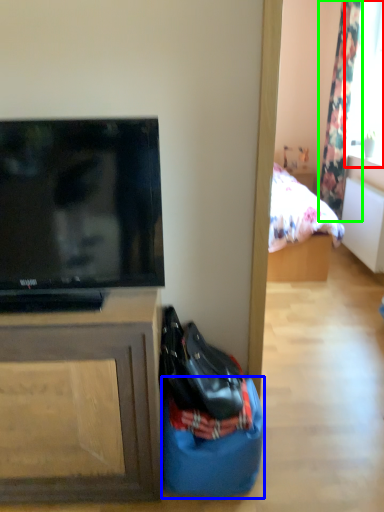
Question: Based on their relative distances, which object is farther from window screen (highlighted by a red box)? Choose from sack (highlighted by a blue box) and curtain (highlighted by a green box).

Choices:
 (A) sack
 (B) curtain

Answer: (A)